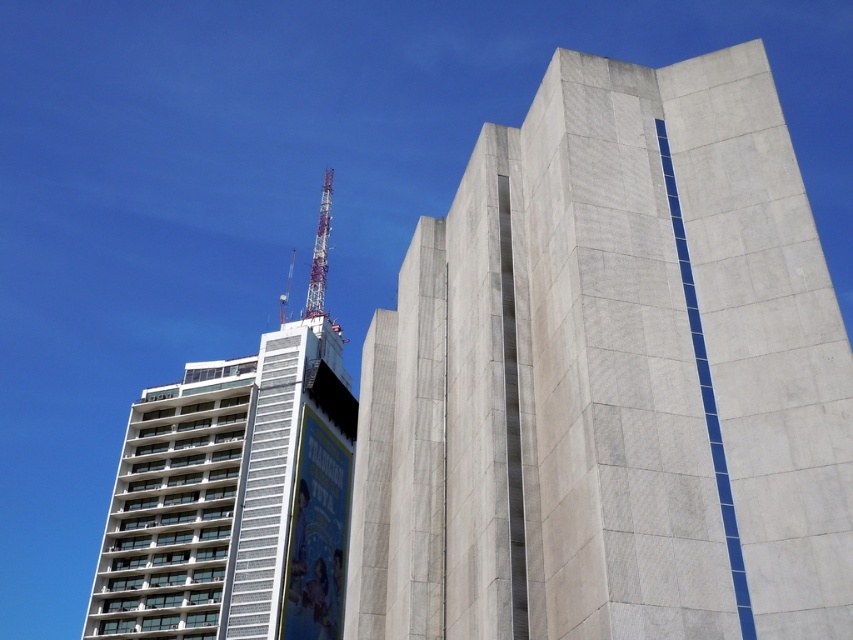
You are an architect analyzing the spatial relationship between the two buildings in the scene. Which of the two buildings, the concrete block building at center or the white concrete building at upper left, has a larger physical size?

The white concrete building at upper left is larger than the concrete block building at center.

You are a city planner observing the two structures at upper center in the image. Which one is bigger in size between the metallic tower at upper center and the metallic silver crane at upper center?

The metallic tower at upper center is larger in size compared to the metallic silver crane at upper center.